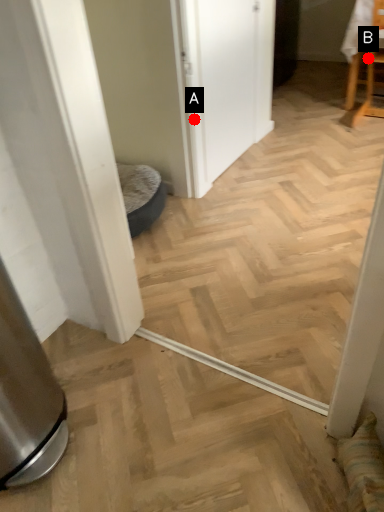
Question: Two points are circled on the image, labeled by A and B beside each circle. Among these points, which one is farthest from the camera?

Choices:
 (A) A is further
 (B) B is further

Answer: (B)